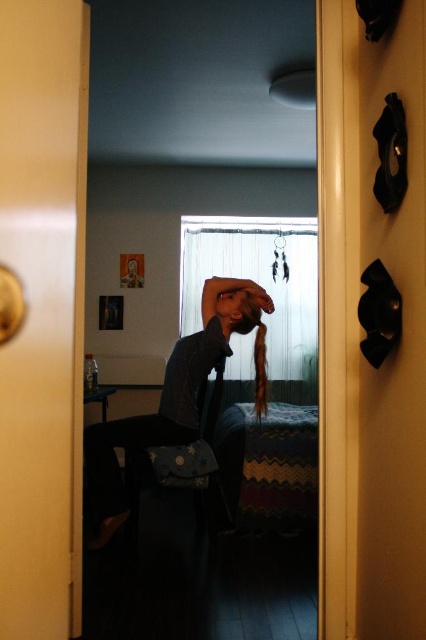
You are a photographer setting up a shoot in this room. You want to ensure both the denim jacket at center and the matte black hair at center are visible in the frame. Given their sizes, which object will require more vertical space in the photo?

The denim jacket at center has a greater height compared to the matte black hair at center, so it will require more vertical space in the photo.

You are standing in the doorway and see both the denim jacket at center and the matte black hair at center. Which object is positioned to the left side from your perspective?

The denim jacket at center is positioned to the left of the matte black hair at center from your perspective.